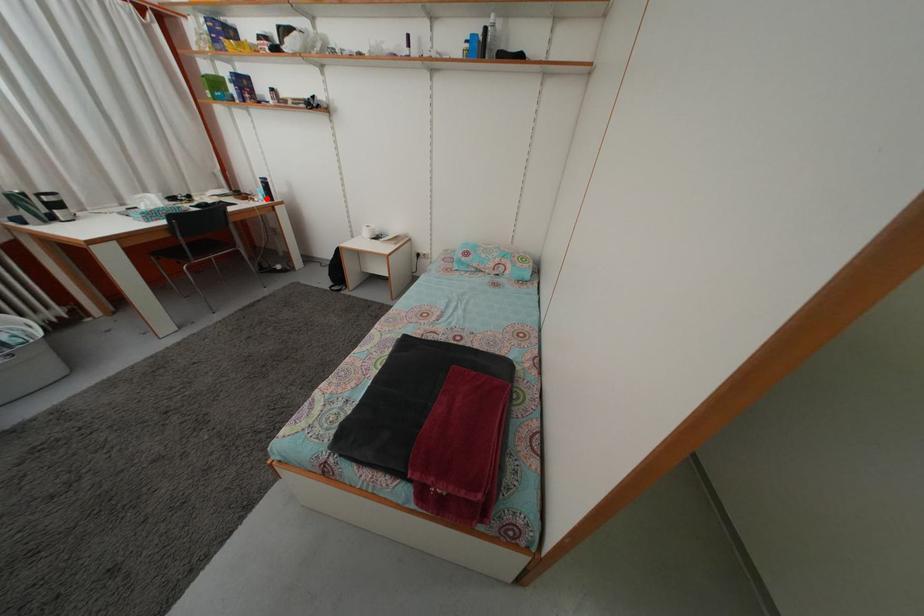
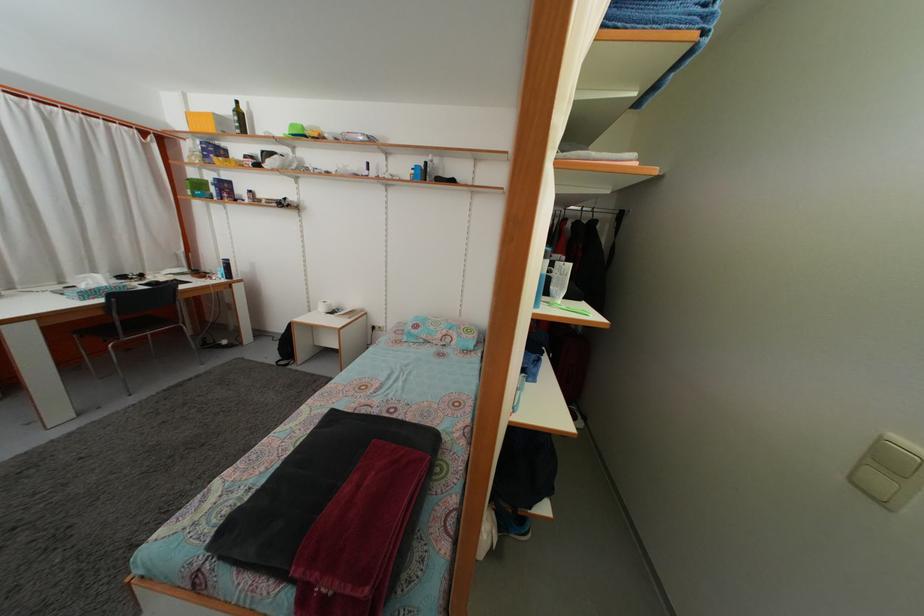
Where in the second image is the point corresponding to the highlighted location from the first image?

(226, 278)